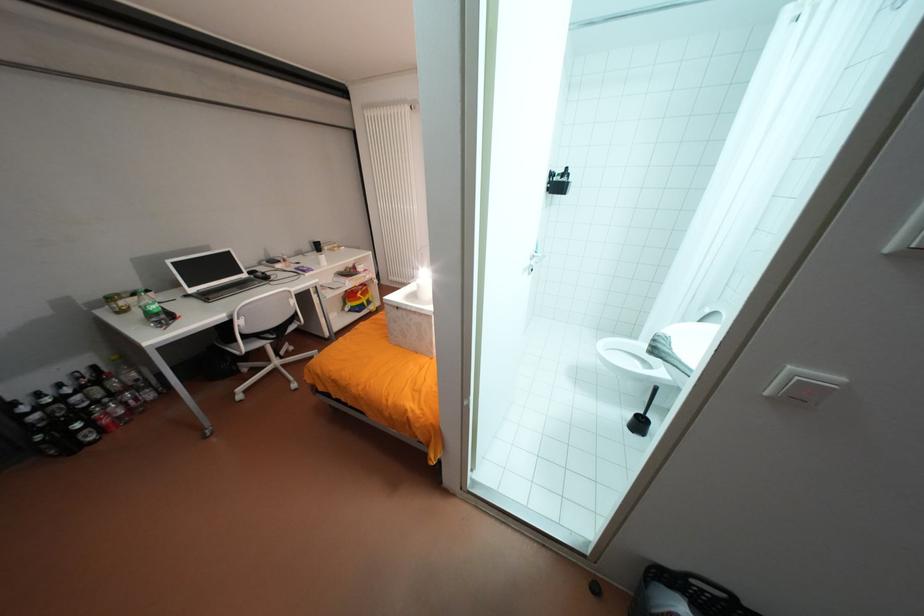
Which object does [683,594] point to?

This point indicates the black laundry basket.